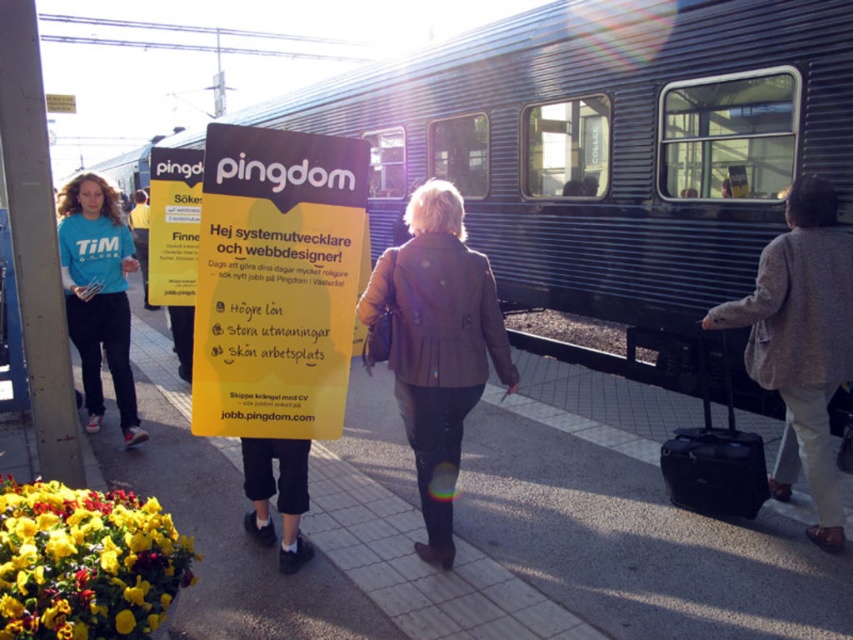
Question: Which point is closer to the camera?

Choices:
 (A) metallic blue train at center
 (B) light beige wool coat at center
 (C) black matte suitcase at lower right
 (D) yellow paper sign at center

Answer: (D)

Question: Is metallic blue train at center thinner than yellow paper sign at center?

Choices:
 (A) yes
 (B) no

Answer: (B)

Question: Is yellow paper sign at center behind brown leather jacket at center?

Choices:
 (A) no
 (B) yes

Answer: (A)

Question: Which point is closer to the camera?

Choices:
 (A) black matte suitcase at lower right
 (B) brown leather jacket at center
 (C) matte blue sweatshirt at left

Answer: (B)

Question: Does light beige wool coat at center have a larger size compared to matte blue sweatshirt at left?

Choices:
 (A) yes
 (B) no

Answer: (B)

Question: Estimate the real-world distances between objects in this image. Which object is farther from the yellow paper sign at center?

Choices:
 (A) matte blue sweatshirt at left
 (B) light beige wool coat at center

Answer: (A)